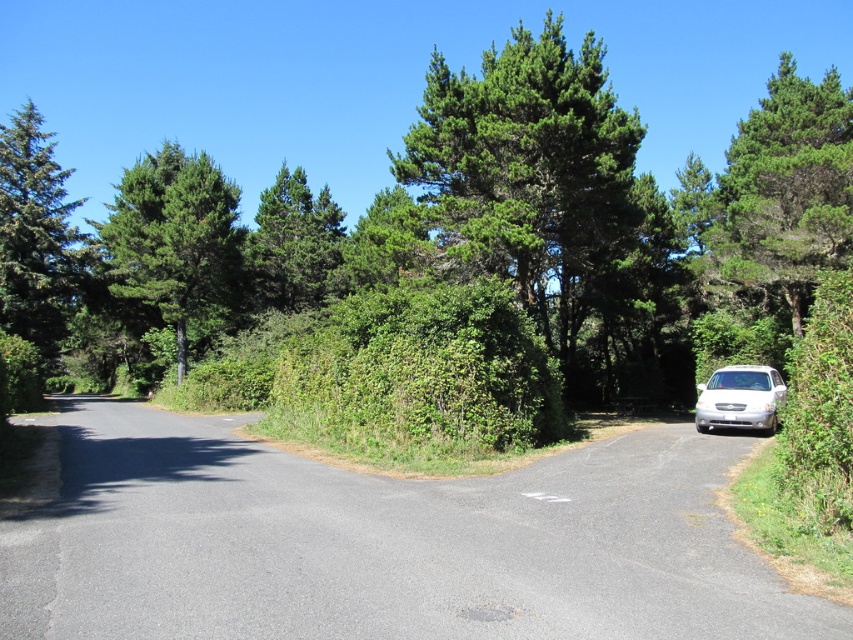
Which is below, asphalt at center or green leafy tree at upper center?

Positioned lower is asphalt at center.

Which is in front, point (99, 582) or point (257, 276)?

Positioned in front is point (99, 582).

Where is `asphalt at center`? asphalt at center is located at coordinates (383, 544).

Does asphalt at center appear on the right side of green needle-like at left?

Yes, asphalt at center is to the right of green needle-like at left.

Describe the element at coordinates (383, 544) in the screenshot. I see `asphalt at center` at that location.

The width and height of the screenshot is (853, 640). In order to click on asphalt at center in this screenshot , I will do `click(383, 544)`.

Which of these two, green leafy tree at center or green needle-like at left, stands taller?

Standing taller between the two is green leafy tree at center.

How distant is green leafy tree at center from green needle-like at left?

green leafy tree at center is 51.09 meters away from green needle-like at left.

This screenshot has height=640, width=853. Describe the element at coordinates (549, 202) in the screenshot. I see `green leafy tree at center` at that location.

Locate an element on the screen. The width and height of the screenshot is (853, 640). green leafy tree at center is located at coordinates (549, 202).